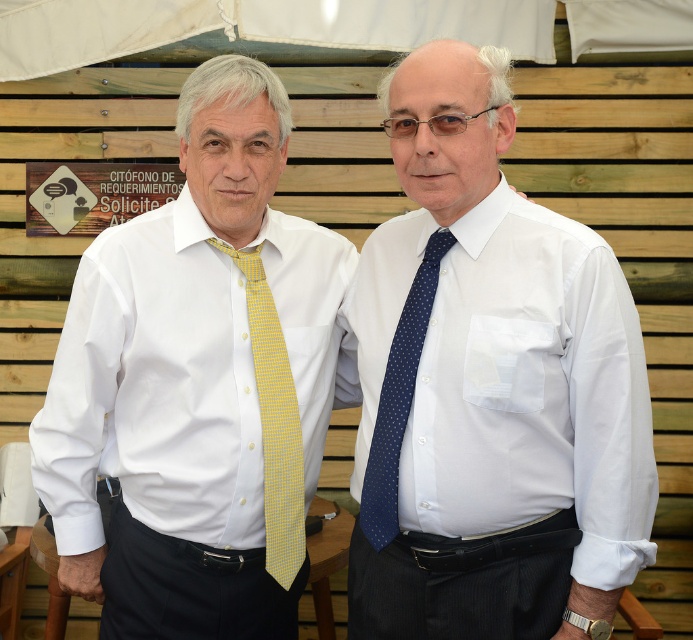
You are a tailor measuring clothing items in the image. You have a measuring tape and need to determine which item is wider between the white smooth shirt at left and the yellow dotted tie at center. Which one is wider?

The white smooth shirt at left is wider than the yellow dotted tie at center according to the description.

You need to decide which item is wider between the white smooth shirt at center and the blue dotted tie at center. Based on the scene description, which one is wider?

The white smooth shirt at center is wider than the blue dotted tie at center according to the description.